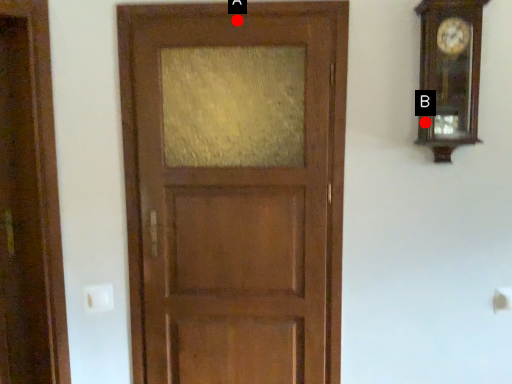
Question: Two points are circled on the image, labeled by A and B beside each circle. Which point is closer to the camera taking this photo?

Choices:
 (A) A is closer
 (B) B is closer

Answer: (B)